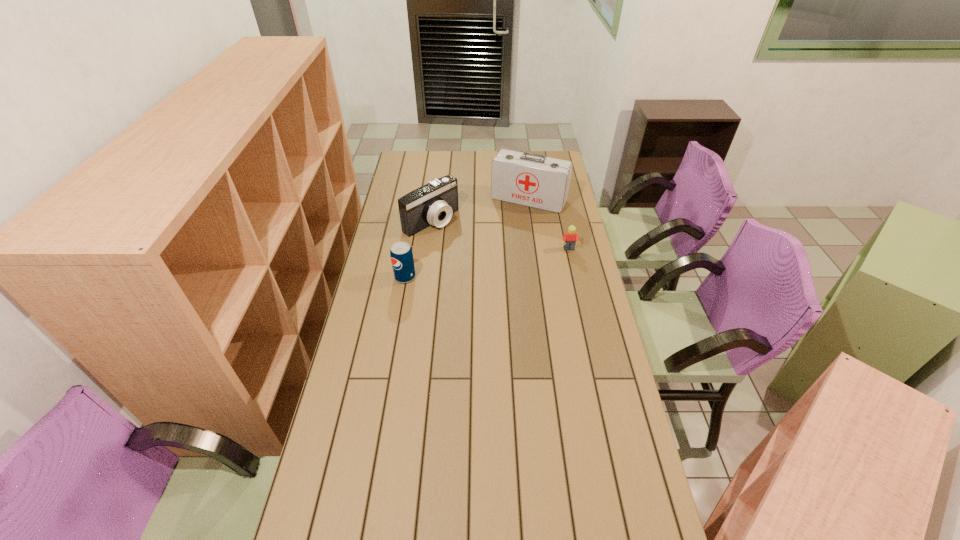
Find the location of a particular element. free space between the camcorder and the Lego is located at coordinates (500, 235).

The height and width of the screenshot is (540, 960). What are the coordinates of `vacant space that's between the shortest object and the tallest object` in the screenshot? It's located at (549, 225).

Locate an element on the screen. This screenshot has width=960, height=540. object that is the second nearest to the Lego is located at coordinates (434, 203).

Point out which object is positioned as the second nearest to the camcorder. Please provide its 2D coordinates. Your answer should be formatted as a tuple, i.e. [(x, y)], where the tuple contains the x and y coordinates of a point satisfying the conditions above.

[(401, 254)]

Find the location of `vacant area in the image that satisfies the following two spatial constraints: 1. on the back side of the third shortest object; 2. on the right side of the pop`. vacant area in the image that satisfies the following two spatial constraints: 1. on the back side of the third shortest object; 2. on the right side of the pop is located at coordinates (415, 221).